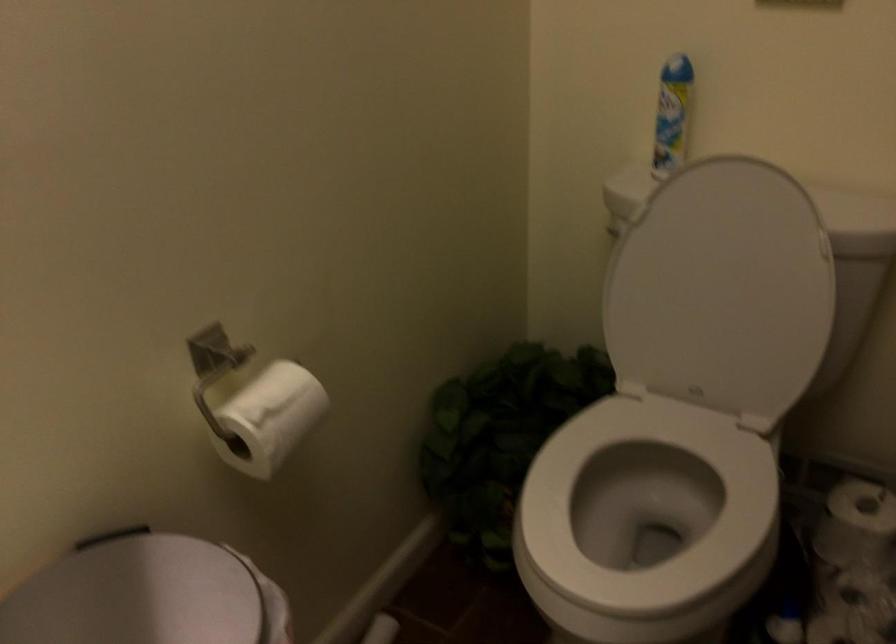
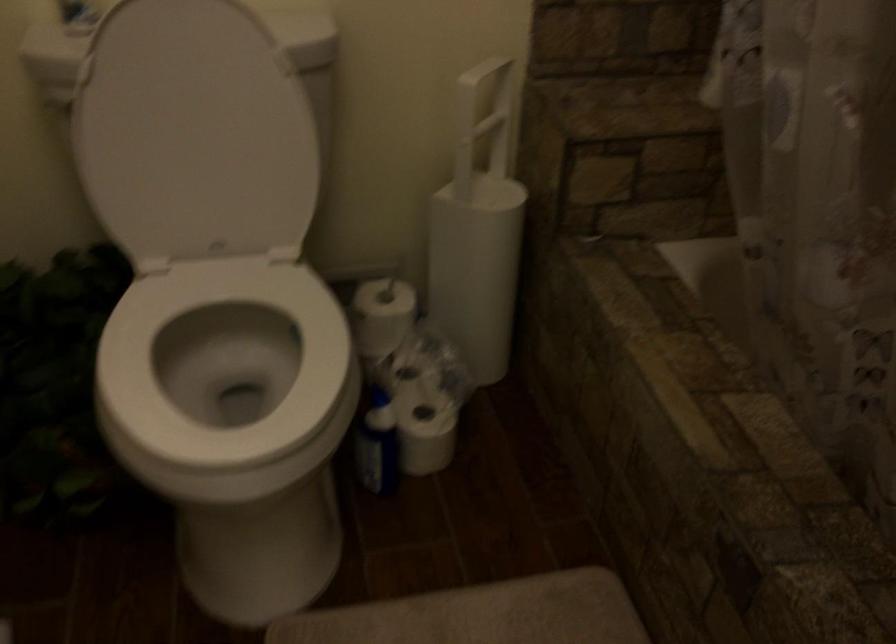
Locate, in the second image, the point that corresponds to (x=701, y=285) in the first image.

(194, 134)